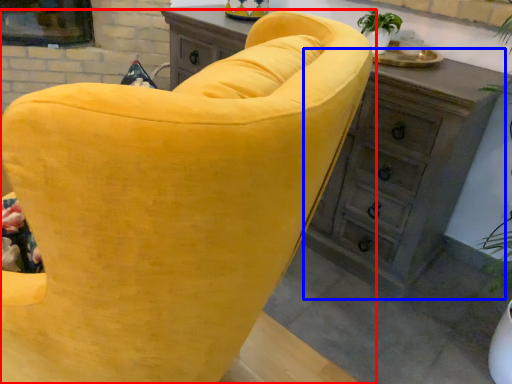
Question: Which object is closer to the camera taking this photo, chair (highlighted by a red box) or dresser (highlighted by a blue box)?

Choices:
 (A) chair
 (B) dresser

Answer: (A)